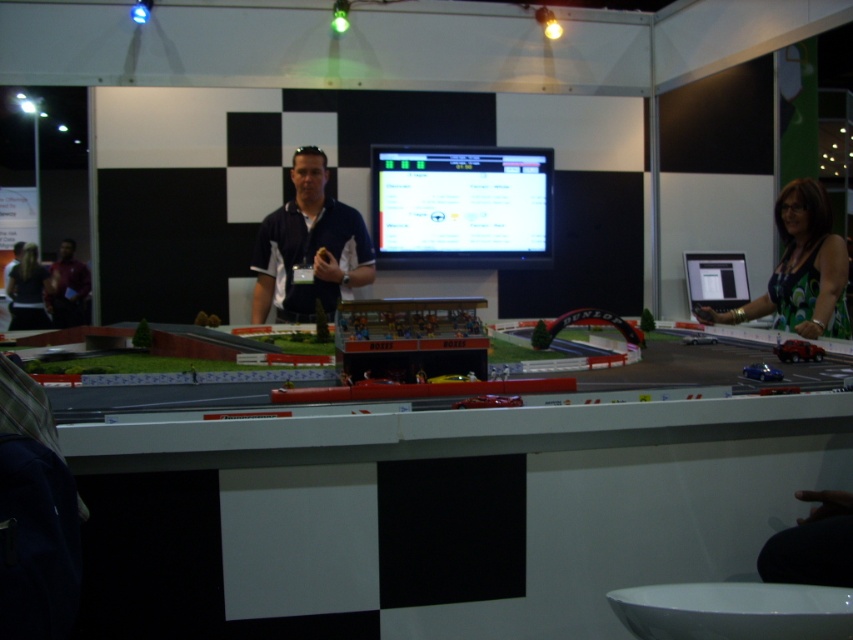
Question: Is green floral dress at right positioned in front of dark gray shirt at left?

Choices:
 (A) yes
 (B) no

Answer: (A)

Question: Which point appears closest to the camera in this image?

Choices:
 (A) (317, 154)
 (B) (834, 308)
 (C) (13, 312)
 (D) (135, 547)

Answer: (D)

Question: Does green floral dress at right lie behind dark gray shirt at left?

Choices:
 (A) yes
 (B) no

Answer: (B)

Question: Which object is positioned closest to the green floral dress at right?

Choices:
 (A) matte blue shirt at center
 (B) white glossy table at center
 (C) matte black shirt at left

Answer: (B)

Question: Does white glossy table at center have a larger size compared to matte blue shirt at center?

Choices:
 (A) no
 (B) yes

Answer: (B)

Question: Considering the real-world distances, which object is farthest from the green floral dress at right?

Choices:
 (A) matte black shirt at left
 (B) matte blue shirt at center
 (C) white glossy table at center

Answer: (A)